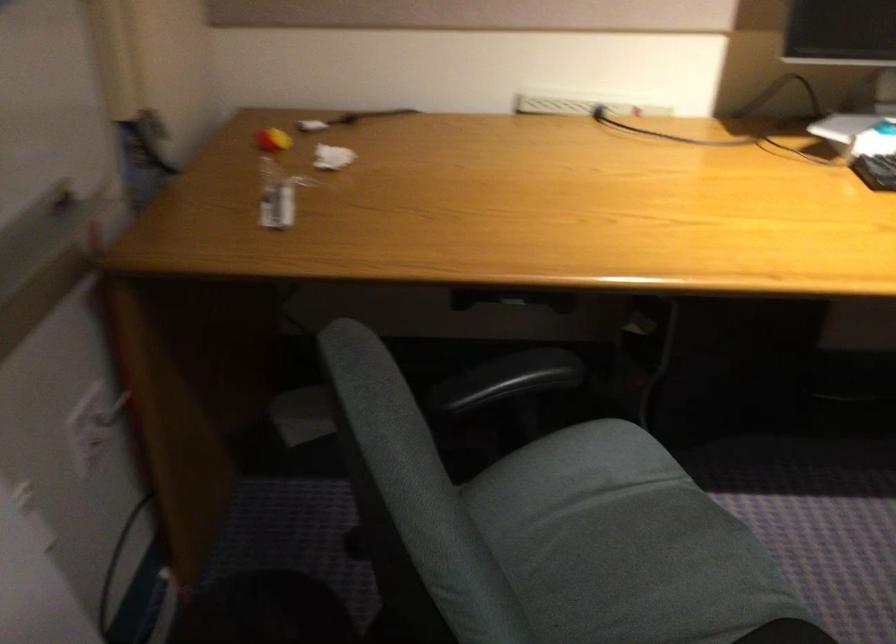
The location [276,196] corresponds to which object?

This point indicates the clear plastic bottle.